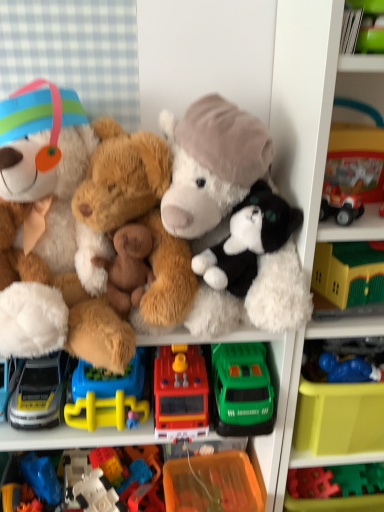
How much space does translucent plastic building blocks at center, which is the fifth toy from right to left, occupy horizontally?

The width of translucent plastic building blocks at center, which is the fifth toy from right to left, is 11.23 inches.

Measure the distance between translucent plastic building blocks at center, which is the second toy from left to right, and camera.

37.24 inches.

Measure the distance between point (199, 351) and camera.

Point (199, 351) and camera are 92.60 centimeters apart from each other.

Identify the location of brown plush bear at center, marked as the third toy in a left-to-right arrangement. This screenshot has height=512, width=384. (128, 266).

What do you see at coordinates (138, 212) in the screenshot? I see `fluffy brown teddy bear at center, the 2th teddy bear when ordered from left to right` at bounding box center [138, 212].

In order to face fluffy brown teddy bear at center, the 2th teddy bear when ordered from left to right, should I rotate leftwards or rightwards?

To face it directly, rotate left by 7.994 degrees.

Where is `fluffy white teddy bear at left, arranged as the 3th teddy bear when viewed from the right`? fluffy white teddy bear at left, arranged as the 3th teddy bear when viewed from the right is located at coordinates (48, 233).

Considering the positions of points (277, 36) and (126, 447), is point (277, 36) farther from camera compared to point (126, 447)?

No, (277, 36) is closer to viewer.

Which is more to the right, white plastic shelf at upper right or translucent plastic building blocks at center, which is the second toy from left to right?

white plastic shelf at upper right.

From the picture: Considering the sizes of white plastic shelf at upper right and translucent plastic building blocks at center, which is the second toy from left to right, in the image, is white plastic shelf at upper right taller or shorter than translucent plastic building blocks at center, which is the second toy from left to right,?

Considering their sizes, white plastic shelf at upper right has more height than translucent plastic building blocks at center, which is the second toy from left to right.

Is translucent plastic building blocks at center, which is the fifth toy from right to left, wider or thinner than white plastic shelf at upper right?

Clearly, translucent plastic building blocks at center, which is the fifth toy from right to left, has less width compared to white plastic shelf at upper right.

In the image, is translucent plastic building blocks at center, which is the fifth toy from right to left, on the left side or the right side of white plastic shelf at upper right?

translucent plastic building blocks at center, which is the fifth toy from right to left, is positioned on white plastic shelf at upper right's left side.

From the image's perspective, which object appears higher, translucent plastic building blocks at center, which is the fifth toy from right to left, or white plastic shelf at upper right?

white plastic shelf at upper right is shown above in the image.

Considering the positions of objects translucent plastic building blocks at center, which is the second toy from left to right, and white plastic shelf at upper right in the image provided, who is in front, translucent plastic building blocks at center, which is the second toy from left to right, or white plastic shelf at upper right?

white plastic shelf at upper right is closer to the camera.

Looking at the image, does orange plastic container at lower center seem bigger or smaller compared to matte blue car at lower left, which is counted as the sixth toy, starting from the right?

orange plastic container at lower center is bigger than matte blue car at lower left, which is counted as the sixth toy, starting from the right.

Would you say orange plastic container at lower center is a long distance from matte blue car at lower left, positioned as the first toy in left-to-right order?

No, orange plastic container at lower center is not far from matte blue car at lower left, positioned as the first toy in left-to-right order.

Considering the sizes of objects orange plastic container at lower center and matte blue car at lower left, positioned as the first toy in left-to-right order, in the image provided, who is wider, orange plastic container at lower center or matte blue car at lower left, positioned as the first toy in left-to-right order,?

matte blue car at lower left, positioned as the first toy in left-to-right order.

Is matte blue car at lower left, positioned as the first toy in left-to-right order, surrounded by orange plastic container at lower center?

No, orange plastic container at lower center does not contain matte blue car at lower left, positioned as the first toy in left-to-right order.

Which object is positioned more to the right, rubber fire truck at center, the fourth toy viewed from the left, or fluffy brown teddy bear at center, the 2th teddy bear when ordered from left to right?

rubber fire truck at center, the fourth toy viewed from the left.

From a real-world perspective, is rubber fire truck at center, the fourth toy viewed from the left, physically below fluffy brown teddy bear at center, arranged as the second teddy bear when viewed from the right?

Correct, in the physical world, rubber fire truck at center, the fourth toy viewed from the left, is lower than fluffy brown teddy bear at center, arranged as the second teddy bear when viewed from the right.

Consider the image. Does rubber fire truck at center, which ranks as the third toy in right-to-left order, have a greater height compared to fluffy brown teddy bear at center, arranged as the second teddy bear when viewed from the right?

No, rubber fire truck at center, which ranks as the third toy in right-to-left order, is not taller than fluffy brown teddy bear at center, arranged as the second teddy bear when viewed from the right.

Is rubber fire truck at center, the fourth toy viewed from the left, positioned beyond the bounds of fluffy brown teddy bear at center, arranged as the second teddy bear when viewed from the right?

rubber fire truck at center, the fourth toy viewed from the left, lies outside fluffy brown teddy bear at center, arranged as the second teddy bear when viewed from the right,'s area.

From the image's perspective, which one is positioned lower, translucent plastic building blocks at center, which is the second toy from left to right, or fluffy white teddy bear at left, acting as the first teddy bear starting from the left?

translucent plastic building blocks at center, which is the second toy from left to right, from the image's perspective.

Is point (80, 458) in front of point (68, 339)?

No, it is not.

Based on the photo, how many degrees apart are the facing directions of translucent plastic building blocks at center, which is the second toy from left to right, and fluffy white teddy bear at left, arranged as the 3th teddy bear when viewed from the right?

They differ by 0.000368 degrees in their facing directions.

From a real-world perspective, which is physically above, translucent plastic building blocks at center, which is the second toy from left to right, or fluffy white teddy bear at left, acting as the first teddy bear starting from the left?

fluffy white teddy bear at left, acting as the first teddy bear starting from the left, is physically above.

Between translucent plastic building blocks at center, which is the second toy from left to right, and green plastic car at center, the 2th toy when ordered from right to left, which one appears on the left side from the viewer's perspective?

translucent plastic building blocks at center, which is the second toy from left to right.

Is point (90, 490) positioned before point (260, 433)?

No.

Considering the sizes of objects translucent plastic building blocks at center, which is the fifth toy from right to left, and green plastic car at center, acting as the fifth toy starting from the left, in the image provided, who is thinner, translucent plastic building blocks at center, which is the fifth toy from right to left, or green plastic car at center, acting as the fifth toy starting from the left,?

translucent plastic building blocks at center, which is the fifth toy from right to left, is thinner.

Consider the image. Is translucent plastic building blocks at center, which is the second toy from left to right, located outside green plastic car at center, the 2th toy when ordered from right to left?

That's correct, translucent plastic building blocks at center, which is the second toy from left to right, is outside of green plastic car at center, the 2th toy when ordered from right to left.

From the image's perspective, relative to orange plastic container at lower center, is fluffy brown teddy bear at center, the 2th teddy bear when ordered from left to right, above or below?

Based on their image positions, fluffy brown teddy bear at center, the 2th teddy bear when ordered from left to right, is located above orange plastic container at lower center.

Considering the relative sizes of fluffy brown teddy bear at center, arranged as the second teddy bear when viewed from the right, and orange plastic container at lower center in the image provided, is fluffy brown teddy bear at center, arranged as the second teddy bear when viewed from the right, smaller than orange plastic container at lower center?

No.

Are fluffy brown teddy bear at center, the 2th teddy bear when ordered from left to right, and orange plastic container at lower center making contact?

There is a gap between fluffy brown teddy bear at center, the 2th teddy bear when ordered from left to right, and orange plastic container at lower center.

Can you tell me how much fluffy brown teddy bear at center, the 2th teddy bear when ordered from left to right, and orange plastic container at lower center differ in facing direction?

The angle between the facing direction of fluffy brown teddy bear at center, the 2th teddy bear when ordered from left to right, and the facing direction of orange plastic container at lower center is 0.000913 degrees.

In the image, there is a white plastic shelf at upper right. Where is `toy below it (from the image's perspective)`? The height and width of the screenshot is (512, 384). toy below it (from the image's perspective) is located at coordinates (110, 483).

What are the coordinates of `bookshelf above the translucent plastic building blocks at center, which is the fifth toy from right to left (from a real-world perspective)` in the screenshot? It's located at (304, 104).

Considering their positions, is fluffy white teddy bear at left, arranged as the 3th teddy bear when viewed from the right, positioned closer to white plastic shelf at upper right than orange plastic container at lower center?

fluffy white teddy bear at left, arranged as the 3th teddy bear when viewed from the right, lies closer to white plastic shelf at upper right than the other object.

Based on their spatial positions, is fluffy brown teddy bear at center, the 2th teddy bear when ordered from left to right, or rubber fire truck at center, which ranks as the third toy in right-to-left order, closer to matte blue car at lower left, which is counted as the sixth toy, starting from the right?

The object closer to matte blue car at lower left, which is counted as the sixth toy, starting from the right, is rubber fire truck at center, which ranks as the third toy in right-to-left order.

Looking at the image, which one is located closer to translucent plastic building blocks at center, which is the second toy from left to right, matte blue car at lower left, positioned as the first toy in left-to-right order, or white plastic shelf at upper right?

The object closer to translucent plastic building blocks at center, which is the second toy from left to right, is matte blue car at lower left, positioned as the first toy in left-to-right order.

Based on their spatial positions, is white plastic shelf at upper right or green plastic car at center, acting as the fifth toy starting from the left, closer to rubber fire truck at center, which ranks as the third toy in right-to-left order?

green plastic car at center, acting as the fifth toy starting from the left, is closer to rubber fire truck at center, which ranks as the third toy in right-to-left order.

Considering their positions, is brown plush bear at center, marked as the 4th toy in a right-to-left arrangement, positioned further to fluffy white teddy bear at center, positioned as the 3th teddy bear in left-to-right order, than blue rubber toy at lower right, marked as the 6th toy in a left-to-right arrangement?

The object further to fluffy white teddy bear at center, positioned as the 3th teddy bear in left-to-right order, is blue rubber toy at lower right, marked as the 6th toy in a left-to-right arrangement.

Which object lies nearer to the anchor point blue rubber toy at lower right, which is counted as the first toy, starting from the right, green plastic car at center, acting as the fifth toy starting from the left, or rubber fire truck at center, the fourth toy viewed from the left?

Based on the image, green plastic car at center, acting as the fifth toy starting from the left, appears to be nearer to blue rubber toy at lower right, which is counted as the first toy, starting from the right.

Estimate the real-world distances between objects in this image. Which object is closer to matte blue car at lower left, which is counted as the sixth toy, starting from the right, translucent plastic building blocks at center, which is the fifth toy from right to left, or rubber fire truck at center, which ranks as the third toy in right-to-left order?

The object closer to matte blue car at lower left, which is counted as the sixth toy, starting from the right, is rubber fire truck at center, which ranks as the third toy in right-to-left order.

Based on their spatial positions, is fluffy brown teddy bear at center, the 2th teddy bear when ordered from left to right, or rubber fire truck at center, which ranks as the third toy in right-to-left order, further from fluffy white teddy bear at left, arranged as the 3th teddy bear when viewed from the right?

Among the two, rubber fire truck at center, which ranks as the third toy in right-to-left order, is located further to fluffy white teddy bear at left, arranged as the 3th teddy bear when viewed from the right.

Where is `teddy bear between fluffy brown teddy bear at center, arranged as the second teddy bear when viewed from the right, and blue rubber toy at lower right, marked as the 6th toy in a left-to-right arrangement, in the horizontal direction`? The height and width of the screenshot is (512, 384). teddy bear between fluffy brown teddy bear at center, arranged as the second teddy bear when viewed from the right, and blue rubber toy at lower right, marked as the 6th toy in a left-to-right arrangement, in the horizontal direction is located at coordinates (234, 219).

I want to click on bookshelf between fluffy brown teddy bear at center, arranged as the second teddy bear when viewed from the right, and orange plastic container at lower center in the up-down direction, so click(x=304, y=104).

Where is `storage box between matte blue car at lower left, positioned as the first toy in left-to-right order, and green plastic car at center, acting as the fifth toy starting from the left, from left to right`? storage box between matte blue car at lower left, positioned as the first toy in left-to-right order, and green plastic car at center, acting as the fifth toy starting from the left, from left to right is located at coordinates (212, 483).

Find the location of a particular element. This screenshot has width=384, height=512. toy between green plastic car at center, acting as the fifth toy starting from the left, and white plastic shelf at upper right from left to right is located at coordinates (349, 369).